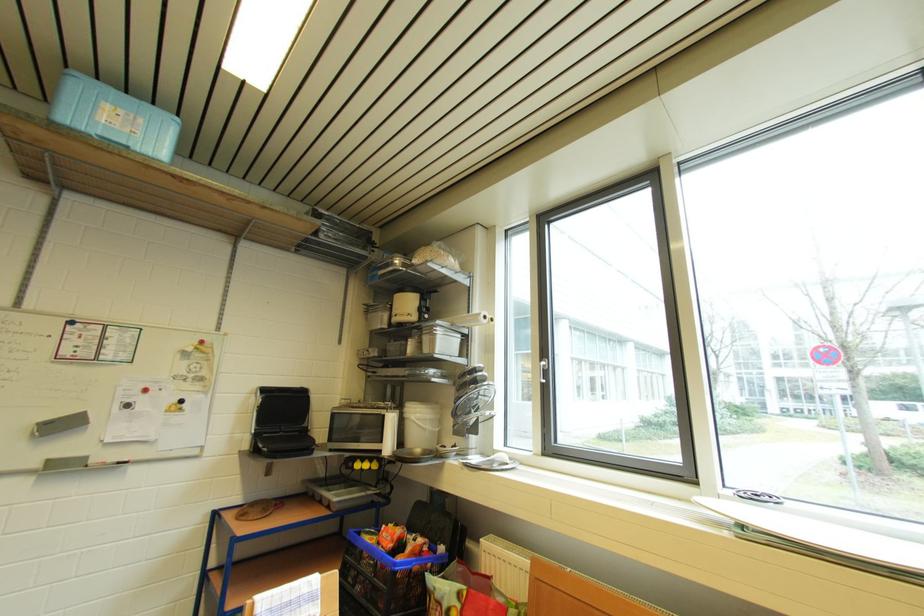
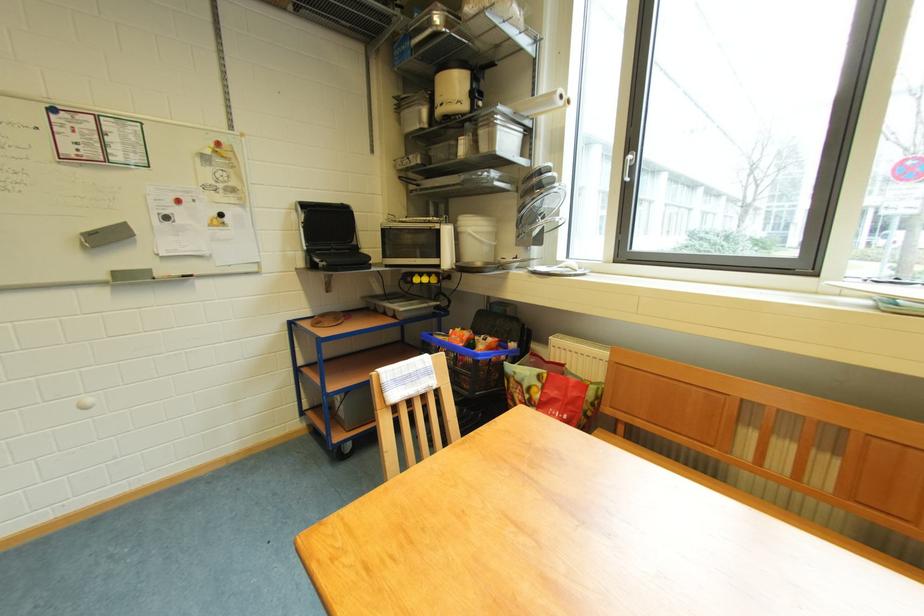
Locate, in the second image, the point that corresponds to point (502, 451) in the first image.

(565, 262)